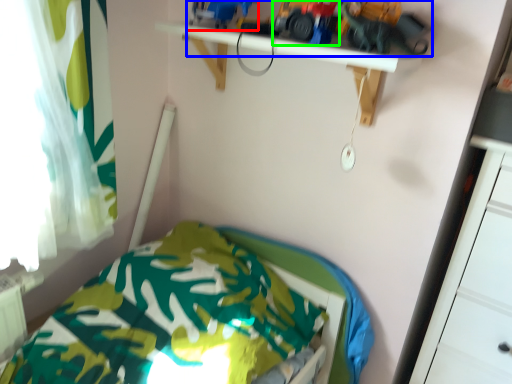
Question: Which object is positioned farthest from toy (highlighted by a red box)? Select from toy (highlighted by a blue box) and toy car (highlighted by a green box).

Choices:
 (A) toy
 (B) toy car

Answer: (B)